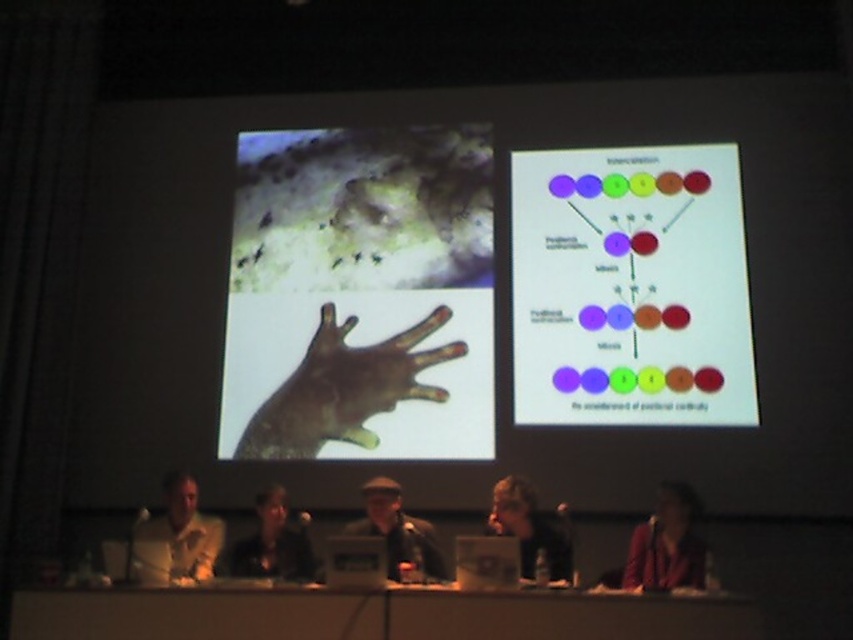
Is matte pink shirt at lower right positioned at the back of yellow matte shirt at left?

No, it is not.

Is matte pink shirt at lower right closer to camera compared to yellow matte shirt at left?

Yes, matte pink shirt at lower right is closer to the viewer.

Where is `matte pink shirt at lower right`? This screenshot has width=853, height=640. matte pink shirt at lower right is located at coordinates (666, 545).

Can you confirm if yellow matte shirt at left is positioned to the left of dark brown leather jacket at center?

Yes, yellow matte shirt at left is to the left of dark brown leather jacket at center.

Is yellow matte shirt at left closer to camera compared to dark brown leather jacket at center?

No, it is not.

Image resolution: width=853 pixels, height=640 pixels. What do you see at coordinates (183, 529) in the screenshot? I see `yellow matte shirt at left` at bounding box center [183, 529].

The width and height of the screenshot is (853, 640). I want to click on yellow matte shirt at left, so click(183, 529).

What do you see at coordinates (666, 545) in the screenshot? I see `matte pink shirt at lower right` at bounding box center [666, 545].

Does matte pink shirt at lower right have a smaller size compared to smooth black hair at lower center?

No.

The image size is (853, 640). What do you see at coordinates (666, 545) in the screenshot?
I see `matte pink shirt at lower right` at bounding box center [666, 545].

Identify the location of matte pink shirt at lower right. (666, 545).